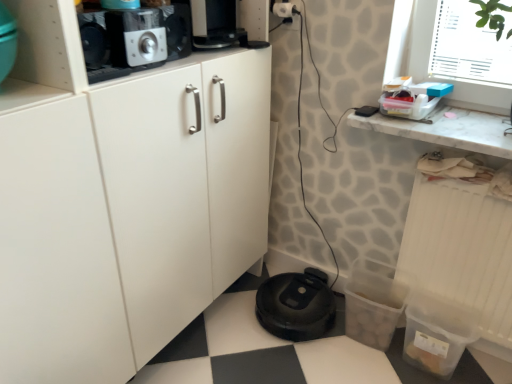
Question: From a real-world perspective, is white plastic window screen at upper right positioned above or below brushed metal toaster at upper left?

Choices:
 (A) below
 (B) above

Answer: (A)

Question: Based on their sizes in the image, would you say white plastic window screen at upper right is bigger or smaller than brushed metal toaster at upper left?

Choices:
 (A) big
 (B) small

Answer: (A)

Question: Estimate the real-world distances between objects in this image. Which object is closer to the white plastic window screen at upper right?

Choices:
 (A) brushed metal toaster at upper left
 (B) white marble countertop at upper right
 (C) black plastic robot vacuum cleaner at lower center
 (D) transparent plastic container at lower right
 (E) white plastic electric outlet at upper right

Answer: (B)

Question: Which object is positioned closest to the black plastic robot vacuum cleaner at lower center?

Choices:
 (A) brushed metal toaster at upper left
 (B) white plastic electric outlet at upper right
 (C) transparent plastic container at lower right
 (D) white marble countertop at upper right
 (E) white plastic window screen at upper right

Answer: (C)